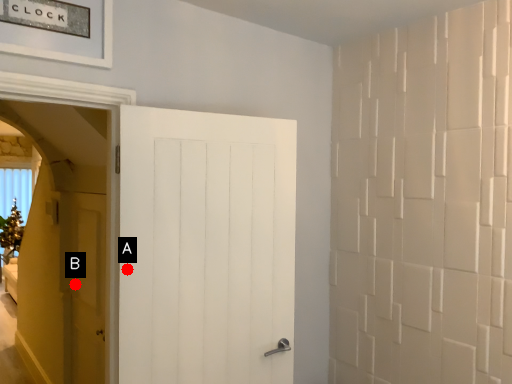
Question: Two points are circled on the image, labeled by A and B beside each circle. Among these points, which one is nearest to the camera?

Choices:
 (A) A is closer
 (B) B is closer

Answer: (A)